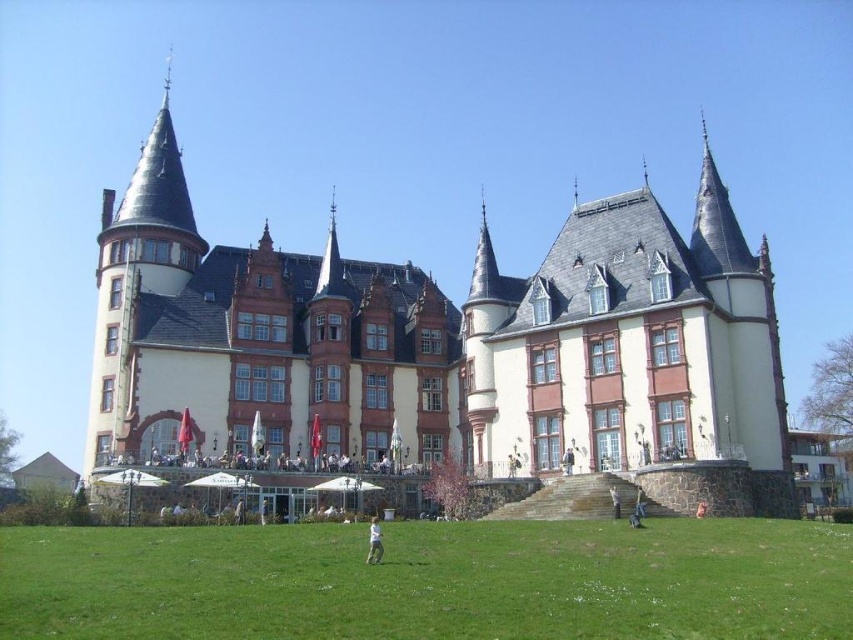
Question: Can you confirm if light brown wooden chair at center is bigger than dark gray fabric jacket at lower center?

Choices:
 (A) no
 (B) yes

Answer: (B)

Question: Which object is positioned farthest from the white cotton shirt at lower center?

Choices:
 (A) white stone castle at center
 (B) light brown wooden chair at center
 (C) dark gray fabric jacket at lower center

Answer: (A)

Question: Which object appears farthest from the camera in this image?

Choices:
 (A) dark gray fabric jacket at lower center
 (B) white stone castle at center
 (C) white cotton shirt at lower center
 (D) light brown wooden chair at center

Answer: (D)

Question: Where is green grass at lower center located in relation to light brown wooden chair at center in the image?

Choices:
 (A) right
 (B) left

Answer: (B)

Question: Which point is farther to the camera?

Choices:
 (A) (614, 516)
 (B) (172, 314)
 (C) (566, 451)
 (D) (781, 556)

Answer: (B)

Question: Is green grass at lower center wider than light brown wooden chair at center?

Choices:
 (A) no
 (B) yes

Answer: (B)